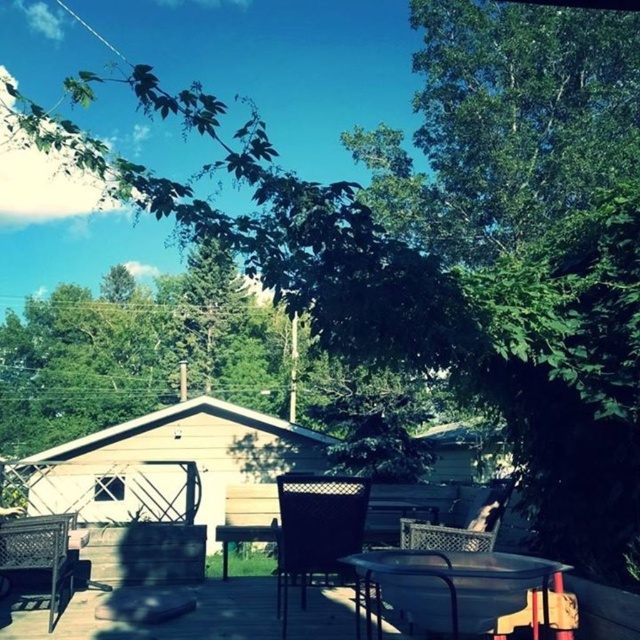
You are standing on the wooden deck and want to place a small potted plant between the two points marked as point (481, 486) and point (481, 508). Since the deck is narrow, you need to know which point is closer to you to ensure the plant is centered. Which point should you place the plant closer to?

You should place the plant closer to point (481, 508) because point (481, 486) is further away from you, making point (481, 508) the closer one for centering the plant between them.

Looking at this image, you are a person who wants to sit on the woven plastic chair at center. Can you step onto the wooden deck at lower center first before reaching the chair?

The wooden deck at lower center has a lesser height compared to woven plastic chair at center, so yes, you can step onto the wooden deck at lower center first before reaching the chair since it is lower in height.

You are setting up a small outdoor dining area and have both a metallic wire chair at center and a woven plastic chair at center. Which chair would you choose if you want the one that takes up more space?

The metallic wire chair at center is larger in size than the woven plastic chair at center, so it would take up more space and be the better choice for that requirement.